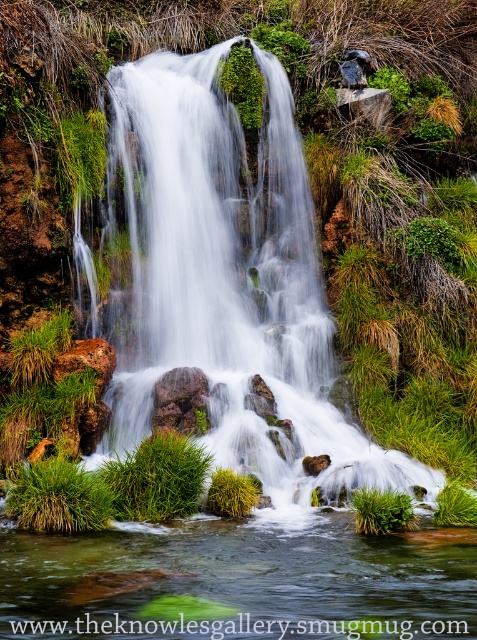
You are standing at the edge of the green grass at lower center and want to cross to the other side. Is the green grassy stream at center a good path to use?

The green grassy stream at center is below the green grass at lower center, so it is located lower in elevation. This means the stream might be a good path to cross since it is at a lower level than the grass where you are standing.

You are a hiker trying to cross the stream. The green grassy stream at center and the rusty rock at center are in your path. Which one is shorter and easier to step over?

The green grassy stream at center has a lesser height compared to the rusty rock at center, so it is shorter and easier to step over.